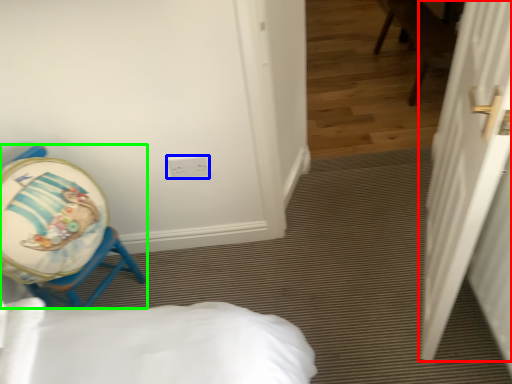
Question: Estimate the real-world distances between objects in this image. Which object is closer to door (highlighted by a red box), electric outlet (highlighted by a blue box) or chair (highlighted by a green box)?

Choices:
 (A) electric outlet
 (B) chair

Answer: (A)